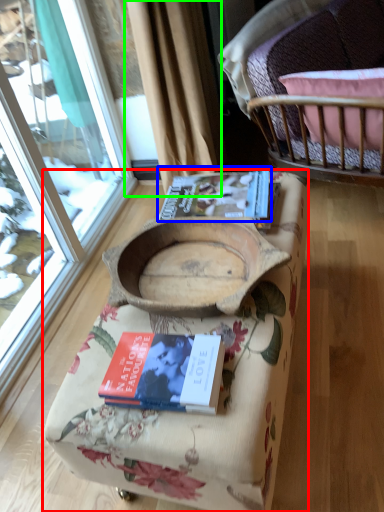
Question: Which is farther away from furniture (highlighted by a red box)? book (highlighted by a blue box) or curtain (highlighted by a green box)?

Choices:
 (A) book
 (B) curtain

Answer: (B)